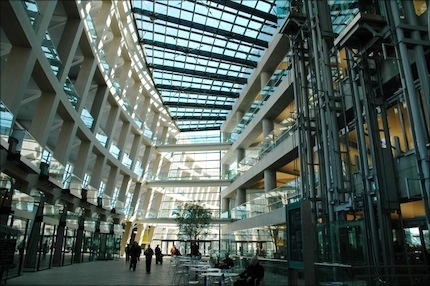
Identify the location of pillar. This screenshot has width=430, height=286. (273, 183).